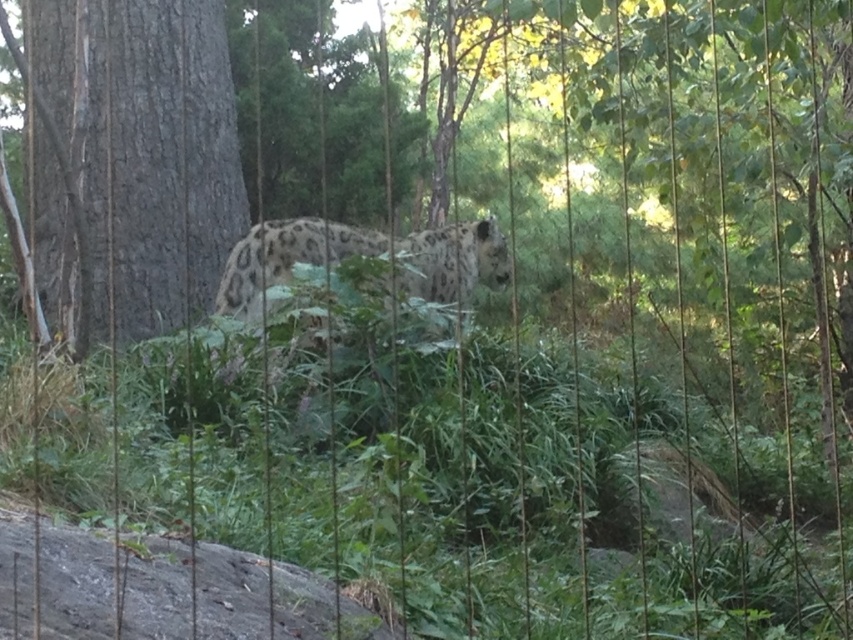
You are a wildlife photographer trying to capture a clear shot of the spotted fur leopard at center. However, the gray textured bark at left is blocking part of your view. Based on their sizes, which object would you need to adjust your position to avoid?

The gray textured bark at left is bigger than the spotted fur leopard at center, so you would need to adjust your position to avoid the gray textured bark at left since it is larger and more obstructive.